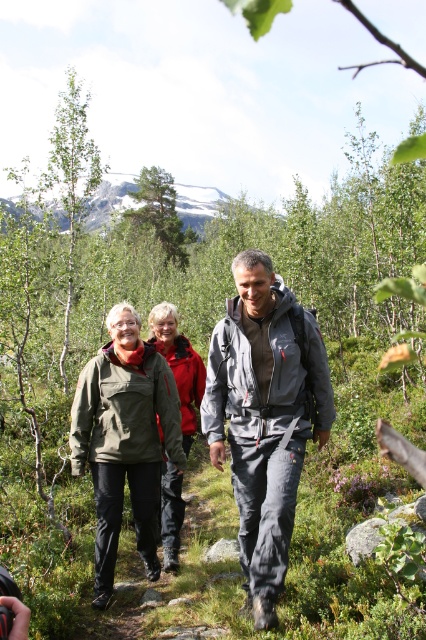
You are a hiker planning to take a photo of the gray fabric jacket at center from a specific angle. Given its 2D coordinates at point 0.653, 0.622, where would you position yourself to capture it clearly?

To capture the gray fabric jacket at center clearly, position yourself in a location that aligns with its 2D coordinates at point [264,417], ensuring you have a clear line of sight without obstructions from the dense vegetation or other hikers.